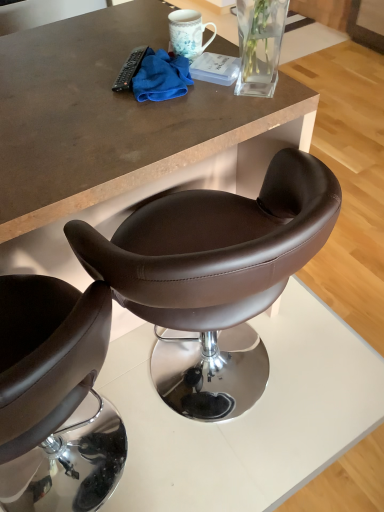
Image resolution: width=384 pixels, height=512 pixels. I want to click on free spot behind black plastic remote control at upper center, so click(x=120, y=44).